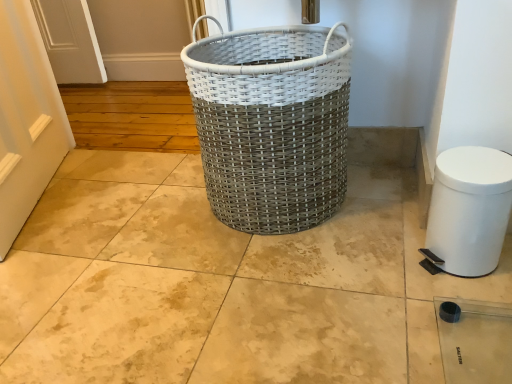
Question: From the image's perspective, is white plastic trash can at lower right located above white woven basket at center?

Choices:
 (A) yes
 (B) no

Answer: (B)

Question: Is white woven basket at center located within white plastic trash can at lower right?

Choices:
 (A) no
 (B) yes

Answer: (A)

Question: Is white woven basket at center at the back of white plastic trash can at lower right?

Choices:
 (A) no
 (B) yes

Answer: (A)

Question: Is white plastic trash can at lower right not near white woven basket at center?

Choices:
 (A) no
 (B) yes

Answer: (A)

Question: Considering the relative positions of white plastic trash can at lower right and white woven basket at center in the image provided, is white plastic trash can at lower right to the left of white woven basket at center from the viewer's perspective?

Choices:
 (A) no
 (B) yes

Answer: (A)

Question: Is the position of white plastic trash can at lower right more distant than that of white woven basket at center?

Choices:
 (A) yes
 (B) no

Answer: (B)

Question: From the image's perspective, is white woven basket at center beneath white plastic trash can at lower right?

Choices:
 (A) no
 (B) yes

Answer: (A)

Question: Could you tell me if white woven basket at center is turned towards white plastic trash can at lower right?

Choices:
 (A) no
 (B) yes

Answer: (A)

Question: From a real-world perspective, is white woven basket at center located higher than white plastic trash can at lower right?

Choices:
 (A) no
 (B) yes

Answer: (B)

Question: Is white plastic trash can at lower right at the back of white woven basket at center?

Choices:
 (A) yes
 (B) no

Answer: (B)

Question: Can you confirm if white woven basket at center is positioned to the left of white plastic trash can at lower right?

Choices:
 (A) yes
 (B) no

Answer: (A)

Question: Is white plastic trash can at lower right inside white woven basket at center?

Choices:
 (A) no
 (B) yes

Answer: (A)

Question: Considering their positions, is white woven basket at center located in front of or behind white plastic trash can at lower right?

Choices:
 (A) front
 (B) behind

Answer: (B)